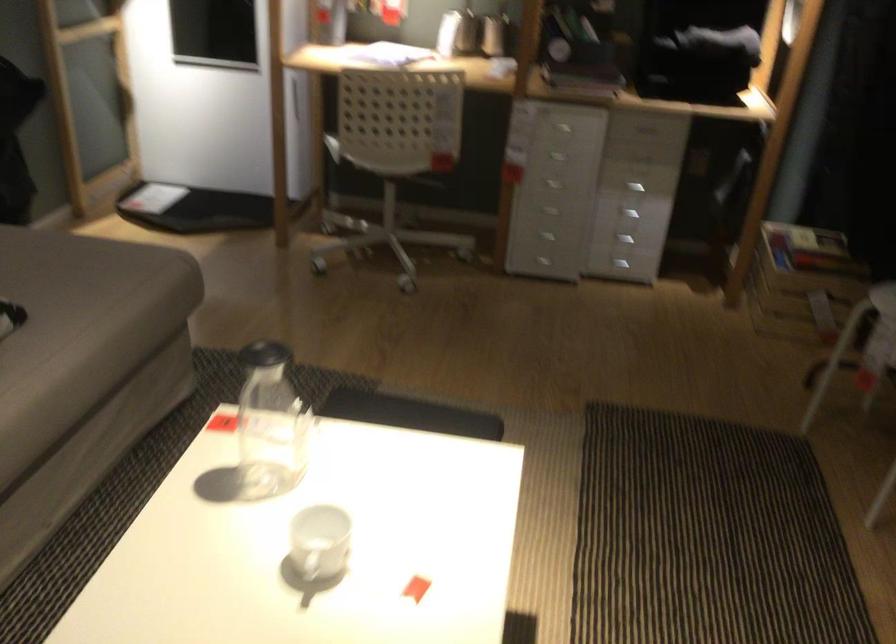
Image resolution: width=896 pixels, height=644 pixels. I want to click on sofa sitting surface, so click(x=82, y=324).